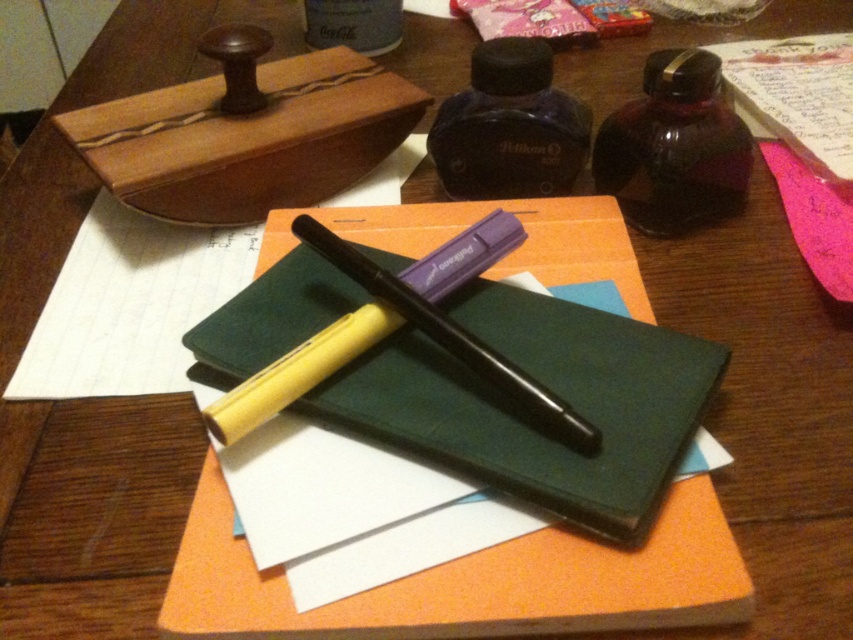
Question: Is dark purple glass ink bottle at center closer to the viewer compared to matte black bottle at upper center?

Choices:
 (A) no
 (B) yes

Answer: (B)

Question: Does green matte notebook at center have a greater width compared to matte black bottle at upper center?

Choices:
 (A) yes
 (B) no

Answer: (A)

Question: Which object is the closest to the green matte notebook at center?

Choices:
 (A) black plastic pen at center
 (B) dark purple glass ink bottle at center

Answer: (A)

Question: Considering the real-world distances, which object is closest to the dark purple glass ink bottle at center?

Choices:
 (A) matte black bottle at upper center
 (B) green matte notebook at center
 (C) black plastic pen at center
 (D) translucent amber bottle at upper right

Answer: (D)

Question: Considering the real-world distances, which object is farthest from the matte black bottle at upper center?

Choices:
 (A) translucent amber bottle at upper right
 (B) green matte notebook at center
 (C) black plastic pen at center

Answer: (B)

Question: From the image, what is the correct spatial relationship of green matte notebook at center in relation to matte black bottle at upper center?

Choices:
 (A) below
 (B) above

Answer: (A)